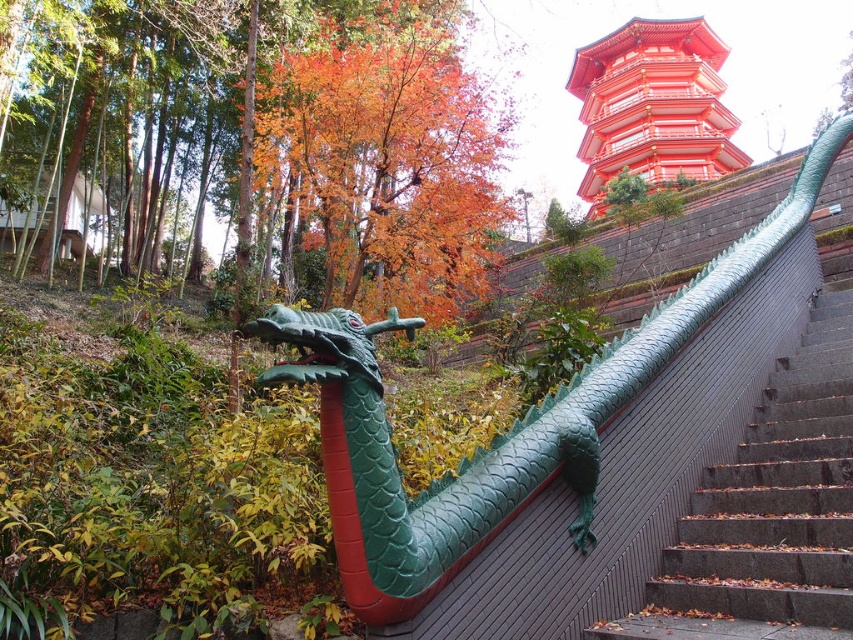
Can you confirm if green scaly dragon at upper center is wider than shiny lacquered pagoda at upper right?

No.

Between point (440, 481) and point (701, 115), which one is positioned in front?

Point (440, 481)

Is point (596, 435) positioned after point (625, 67)?

No, it is not.

Identify the location of green scaly dragon at upper center. (498, 436).

Does green matte dragon at center have a lesser width compared to shiny lacquered pagoda at upper right?

Correct, green matte dragon at center's width is less than shiny lacquered pagoda at upper right's.

Is point (334, 422) closer to viewer compared to point (608, 115)?

Yes, point (334, 422) is in front of point (608, 115).

I want to click on green matte dragon at center, so click(397, 464).

Between point (814, 552) and point (589, 173), which one is positioned behind?

The point (589, 173) is more distant.

Is gray concrete stairs at lower right below shiny lacquered pagoda at upper right?

Yes.

Locate an element on the screen. The height and width of the screenshot is (640, 853). gray concrete stairs at lower right is located at coordinates (769, 509).

Where is `gray concrete stairs at lower right`? This screenshot has height=640, width=853. gray concrete stairs at lower right is located at coordinates (x=769, y=509).